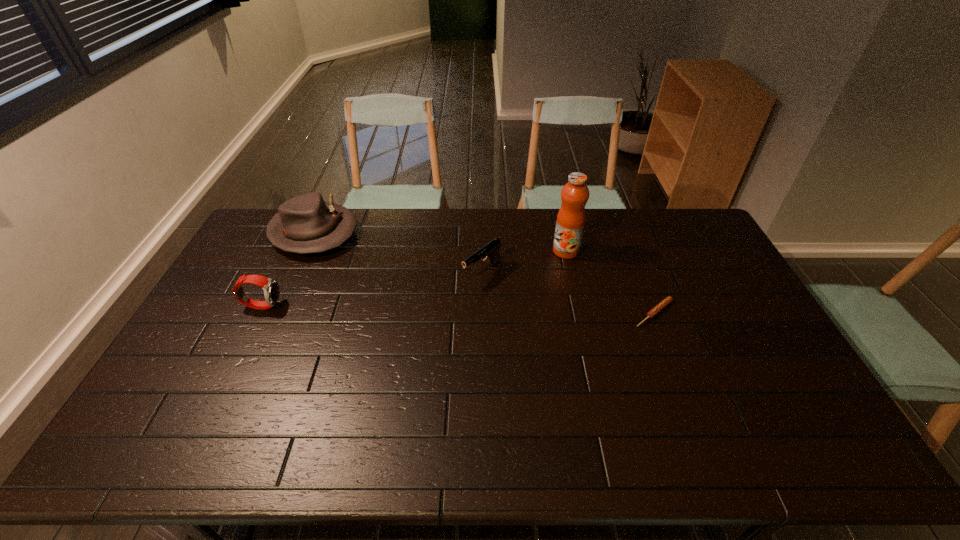
Where is `empty space between the rightmost object and the pistol`? The width and height of the screenshot is (960, 540). empty space between the rightmost object and the pistol is located at coordinates (568, 293).

You are a GUI agent. You are given a task and a screenshot of the screen. Output one action in this format:
    pyautogui.click(x=<x>, y=<y>)
    Task: Click on the free area in between the watch and the pistol
    The height and width of the screenshot is (540, 960).
    Given the screenshot: What is the action you would take?
    pyautogui.click(x=372, y=289)

Locate an element on the screen. Image resolution: width=960 pixels, height=540 pixels. vacant area that lies between the pistol and the sausage is located at coordinates (568, 293).

I want to click on blank region between the fruit juice and the sausage, so click(610, 282).

Locate an element on the screen. The width and height of the screenshot is (960, 540). free spot between the fruit juice and the watch is located at coordinates (414, 278).

You are a GUI agent. You are given a task and a screenshot of the screen. Output one action in this format:
    pyautogui.click(x=<x>, y=<y>)
    Task: Click on the vacant area that lies between the hat and the second object from right to left
    The image size is (960, 540).
    Given the screenshot: What is the action you would take?
    pyautogui.click(x=440, y=242)

You are a GUI agent. You are given a task and a screenshot of the screen. Output one action in this format:
    pyautogui.click(x=<x>, y=<y>)
    Task: Click on the free space that is in between the pistol and the fruit juice
    
    Given the screenshot: What is the action you would take?
    pyautogui.click(x=524, y=262)

Where is `the fourth closest object relative to the watch`? The image size is (960, 540). the fourth closest object relative to the watch is located at coordinates (664, 303).

Identify which object is the second nearest to the rightmost object. Please provide its 2D coordinates. Your answer should be formatted as a tuple, i.e. [(x, y)], where the tuple contains the x and y coordinates of a point satisfying the conditions above.

[(491, 249)]

You are a GUI agent. You are given a task and a screenshot of the screen. Output one action in this format:
    pyautogui.click(x=<x>, y=<y>)
    Task: Click on the free space that satisfies the following two spatial constraints: 1. on the front side of the tallest object; 2. on the left side of the shortest object
    
    Given the screenshot: What is the action you would take?
    pyautogui.click(x=580, y=314)